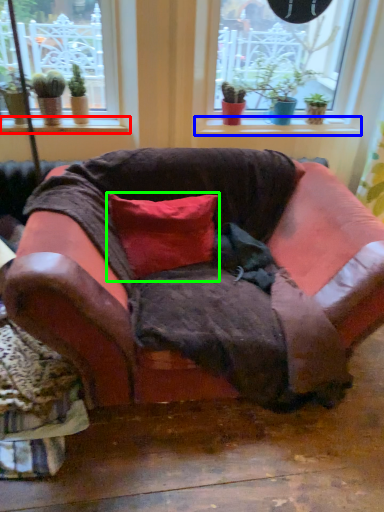
Question: Which is nearer to the window sill (highlighted by a red box)? window sill (highlighted by a blue box) or pillow (highlighted by a green box).

Choices:
 (A) window sill
 (B) pillow

Answer: (B)